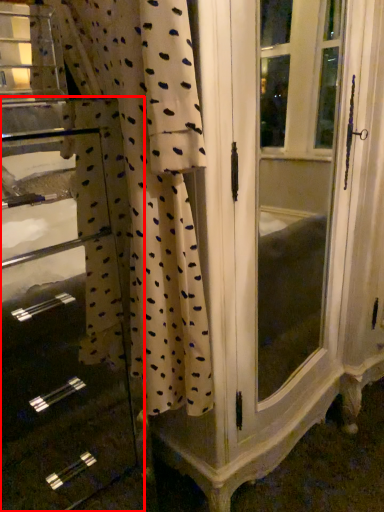
Question: Considering the relative positions of file cabinet (annotated by the red box) and curtain in the image provided, where is file cabinet (annotated by the red box) located with respect to the staircase?

Choices:
 (A) left
 (B) right

Answer: (A)